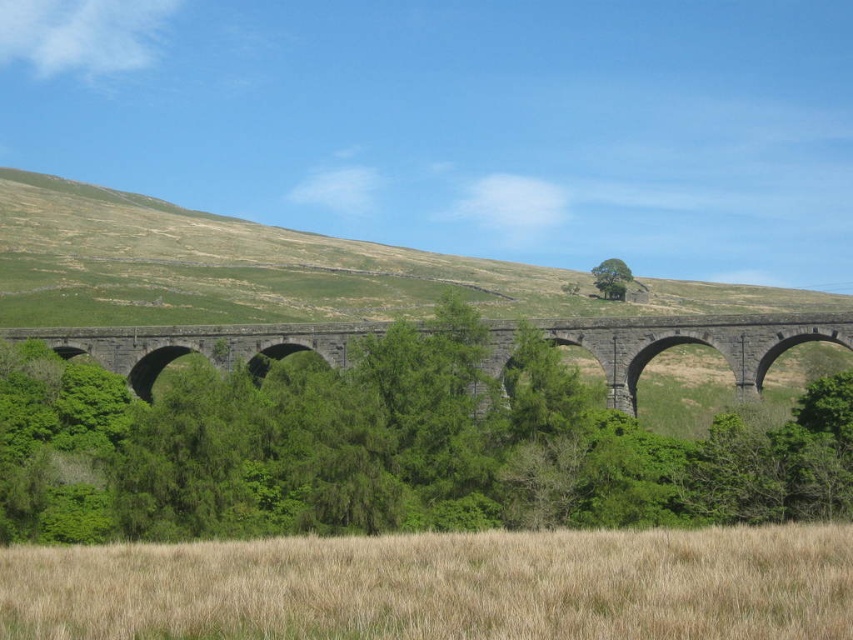
Who is taller, green grassy hillside at upper center or dark gray stone bridge at center?

green grassy hillside at upper center

What do you see at coordinates (289, 266) in the screenshot? I see `green grassy hillside at upper center` at bounding box center [289, 266].

Between point (234, 316) and point (769, 316), which one is positioned in front?

Positioned in front is point (769, 316).

This screenshot has width=853, height=640. I want to click on green grassy hillside at upper center, so coord(289,266).

Is point (579, 332) behind point (596, 276)?

No, it is not.

Is point (738, 381) in front of point (611, 262)?

Yes.

Where is `dark gray stone bridge at center`? Image resolution: width=853 pixels, height=640 pixels. dark gray stone bridge at center is located at coordinates (672, 342).

Which of these two, green grassy hillside at upper center or green leafy tree at center, stands shorter?

With less height is green leafy tree at center.

Does point (41, 173) lie behind point (602, 296)?

Yes, point (41, 173) is behind point (602, 296).

Is point (39, 292) less distant than point (602, 292)?

Yes, it is in front of point (602, 292).

This screenshot has width=853, height=640. Identify the location of green grassy hillside at upper center. (289, 266).